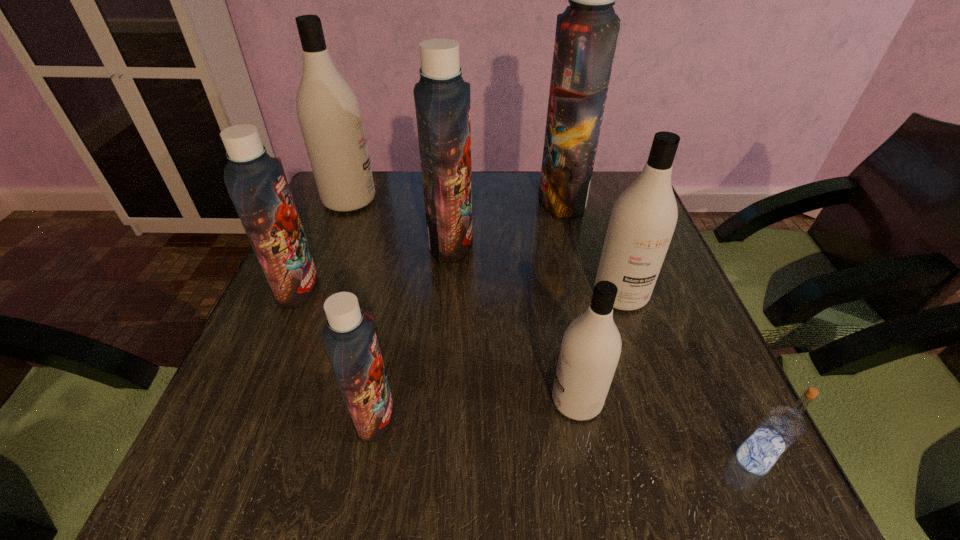
Where is `vacant area situated on the front label of the leftmost blue shampoo`? vacant area situated on the front label of the leftmost blue shampoo is located at coordinates (386, 288).

This screenshot has width=960, height=540. I want to click on blank area located 0.160m on the front-facing side of the rightmost white shampoo, so click(649, 381).

Locate an element on the screen. free space located on the front label of the third object from left to right is located at coordinates (590, 415).

Find the location of a particular element. vacant area located 0.200m on the front-facing side of the smallest white shampoo is located at coordinates (435, 400).

At what (x,y) coordinates should I click in order to perform the action: click on free space located on the front-facing side of the smallest white shampoo. Please return your answer as a coordinate pair (x, y). Looking at the image, I should click on (354, 400).

Where is `vacant region located on the front-facing side of the smallest white shampoo`? Image resolution: width=960 pixels, height=540 pixels. vacant region located on the front-facing side of the smallest white shampoo is located at coordinates (505, 400).

Find the location of a particular element. This screenshot has width=960, height=540. vacant region located 0.190m on the back of the rightmost object is located at coordinates click(x=702, y=350).

Image resolution: width=960 pixels, height=540 pixels. In order to click on shampoo situated at the near edge in this screenshot , I will do coord(350,340).

Where is `vodka present at the near edge`? vodka present at the near edge is located at coordinates (781, 427).

Locate an element on the screen. vodka located at the right edge is located at coordinates (781, 427).